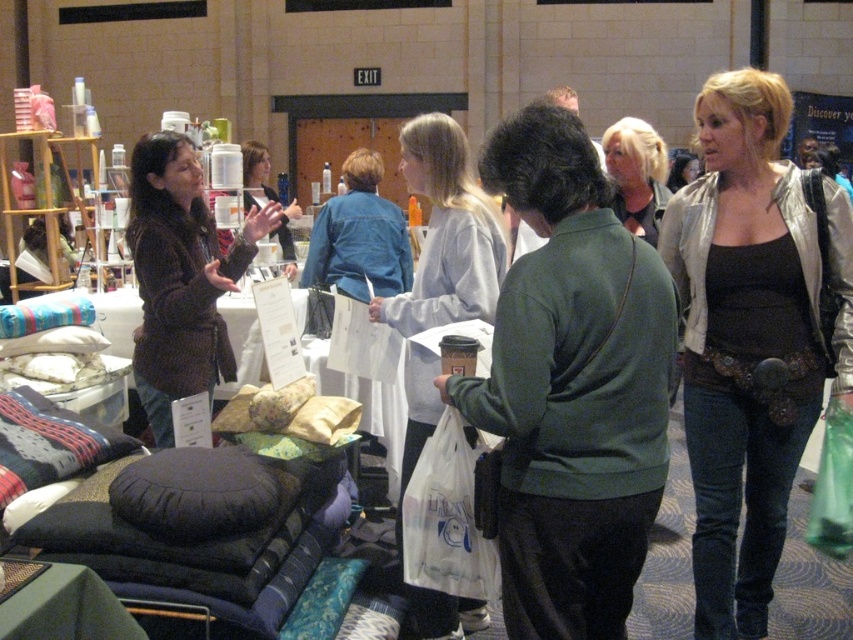
Question: Is light gray sweater at center to the left of blonde hair at center from the viewer's perspective?

Choices:
 (A) no
 (B) yes

Answer: (B)

Question: Which object is farther from the camera taking this photo?

Choices:
 (A) matte brown hair at center
 (B) silver metallic jacket at center
 (C) blonde hair at center

Answer: (A)

Question: Which object is positioned farthest from the silver metallic jacket at center?

Choices:
 (A) matte brown hair at center
 (B) brown fuzzy sweater at upper left
 (C) blonde hair at center

Answer: (A)

Question: Does brown fuzzy sweater at upper left have a smaller size compared to matte brown hair at center?

Choices:
 (A) yes
 (B) no

Answer: (A)

Question: Which point is farther to the camera?

Choices:
 (A) blonde hair at center
 (B) light gray sweater at center
 (C) brown fuzzy sweater at upper left
 (D) matte brown hair at center

Answer: (D)

Question: Observing the image, what is the correct spatial positioning of light gray sweater at center in reference to matte brown hair at center?

Choices:
 (A) left
 (B) right

Answer: (B)